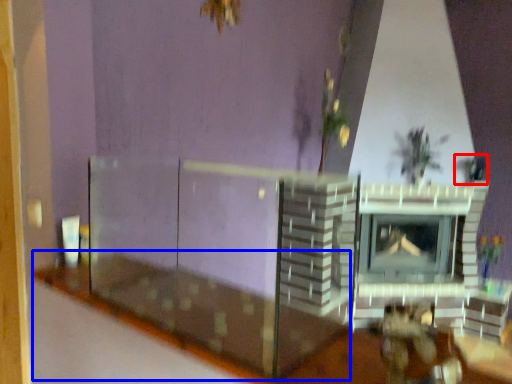
Question: Which object is further to the camera taking this photo, plant (highlighted by a red box) or table (highlighted by a blue box)?

Choices:
 (A) plant
 (B) table

Answer: (A)